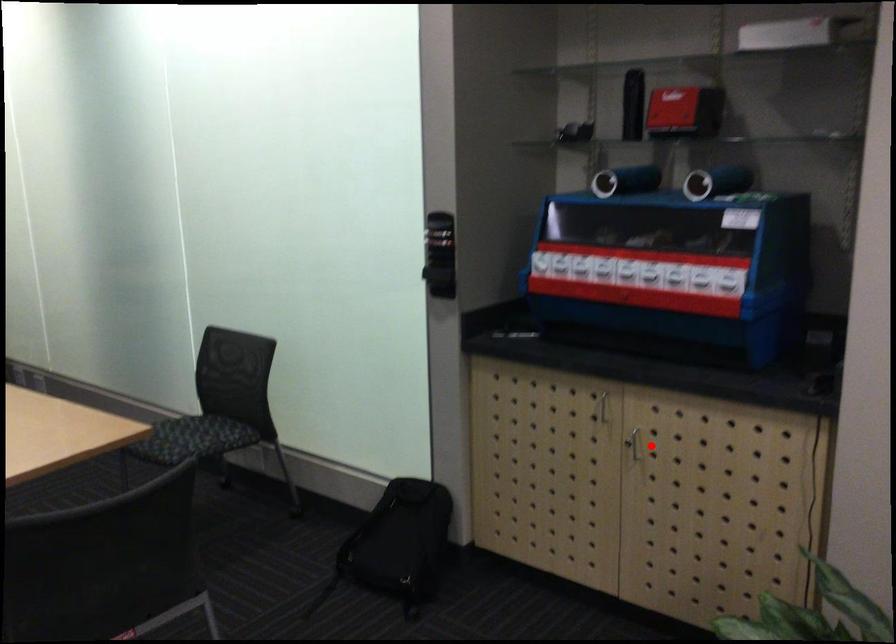
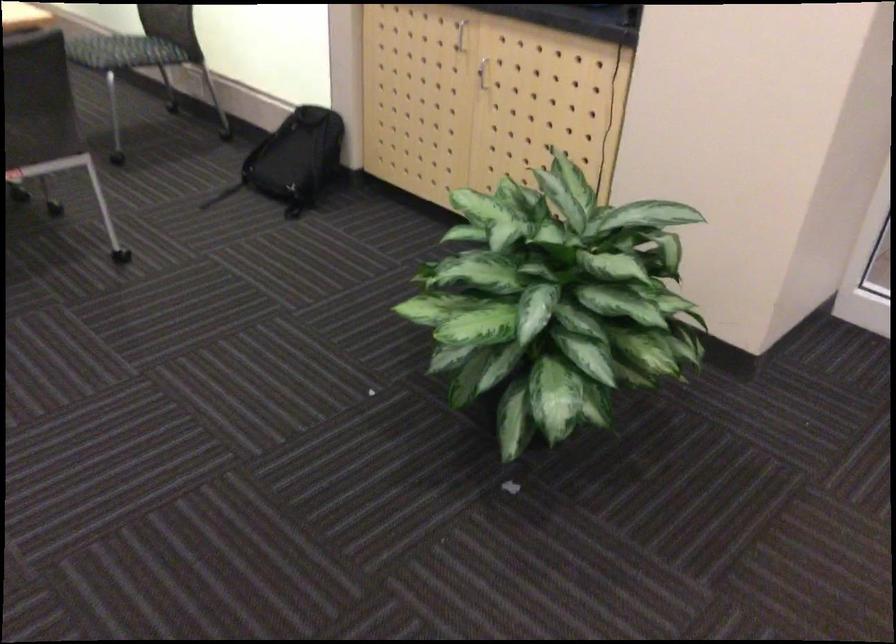
Where in the second image is the point corresponding to the highlighted location from the first image?

(483, 73)